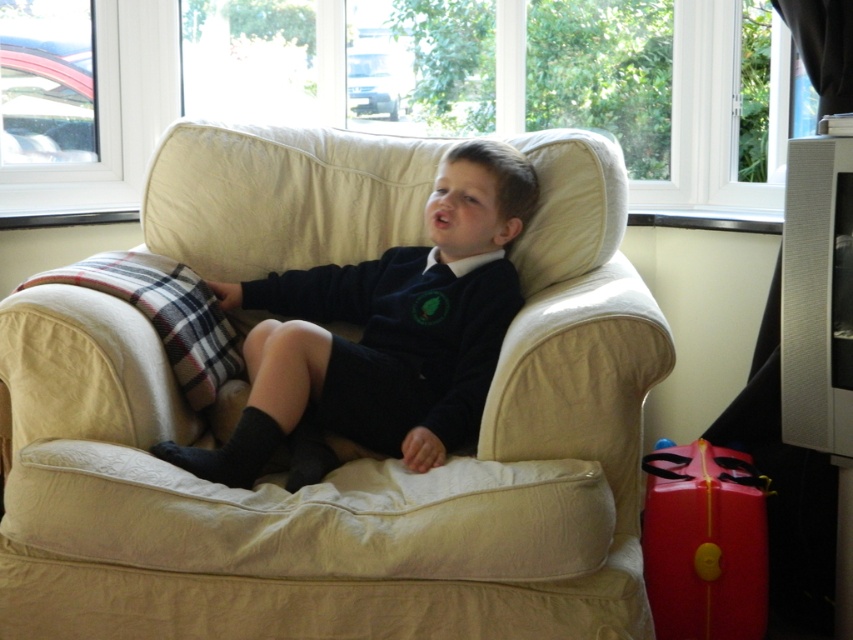
You are a parent helping your child pack for a school trip. You have a dark blue jersey at center and a rubberized red suitcase at lower right. Which item should you choose to ensure the suitcase can fit the jersey without overpacking?

The dark blue jersey at center has a larger size compared to the rubberized red suitcase at lower right, so you should choose the rubberized red suitcase at lower right to ensure it can fit the jersey without overpacking.

In the scene shown: You are a delivery person who needs to bring the rubberized red suitcase at lower right into the living room. The entrance door is narrow and only allows items up to the width of the beige fabric armchair at center to pass through. Can the suitcase fit through the door?

The beige fabric armchair at center might be wider than the rubberized red suitcase at lower right. Since the door allows items up to the width of the armchair, the suitcase should fit as it is likely narrower than the chair.

You are a delivery person who needs to place the rubberized red suitcase at lower right next to the beige fabric armchair at center. Considering the size of both objects, will the suitcase fit comfortably next to the armchair?

The beige fabric armchair at center is bigger than the rubberized red suitcase at lower right, so the suitcase will fit comfortably next to the armchair.